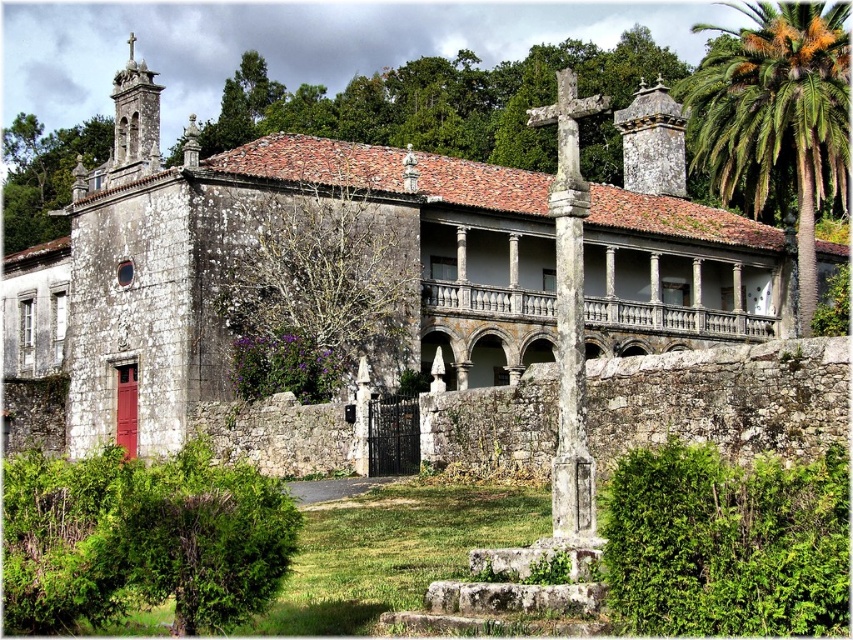
Consider the image. You are standing in a field 30 meters away from the stone church at center. You want to take a photo of it with your smartphone. Will you be able to capture the entire building in one frame without moving closer?

The stone church at center is 30.84 meters away from the camera. Since you are only 30 meters away, you are actually closer than the required distance, so you can capture the entire building in one frame without moving closer.

You are standing in front of the historic stone building and notice a green leafy palm tree in the distance. Which object is positioned to the right side of the other between the stone church at center and the green leafy palm at upper right?

The stone church at center is to the left of green leafy palm at upper right, so the green leafy palm at upper right is positioned to the right side of the stone church at center.